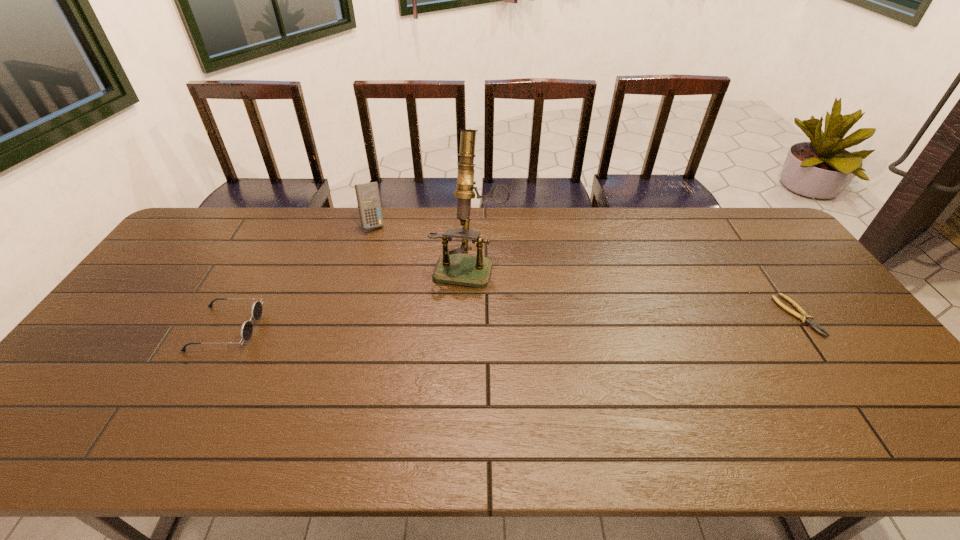
Where is `vacant space at the near edge`? The width and height of the screenshot is (960, 540). vacant space at the near edge is located at coordinates (429, 392).

Locate an element on the screen. The width and height of the screenshot is (960, 540). free space at the left edge of the desktop is located at coordinates (168, 320).

Find the location of `blank area at the right edge`. blank area at the right edge is located at coordinates (843, 371).

You are a GUI agent. You are given a task and a screenshot of the screen. Output one action in this format:
    pyautogui.click(x=<x>, y=<y>)
    Task: Click on the free space at the near left corner of the desktop
    The height and width of the screenshot is (540, 960).
    Given the screenshot: What is the action you would take?
    pyautogui.click(x=53, y=413)

At what (x,y) coordinates should I click in order to perform the action: click on vacant area between the pliers and the farthest object. Please return your answer as a coordinate pair (x, y). This screenshot has width=960, height=540. Looking at the image, I should click on (586, 269).

Identify the location of free spot between the shortest object and the leftmost object. (512, 322).

I want to click on free space between the calculator and the microscope, so click(x=421, y=244).

The width and height of the screenshot is (960, 540). Find the location of `empty space that is in between the calculator and the pliers`. empty space that is in between the calculator and the pliers is located at coordinates (586, 269).

The image size is (960, 540). I want to click on unoccupied area between the third nearest object and the sunglasses, so click(348, 296).

Locate an element on the screen. This screenshot has height=540, width=960. vacant area that lies between the microscope and the pliers is located at coordinates pyautogui.click(x=634, y=290).